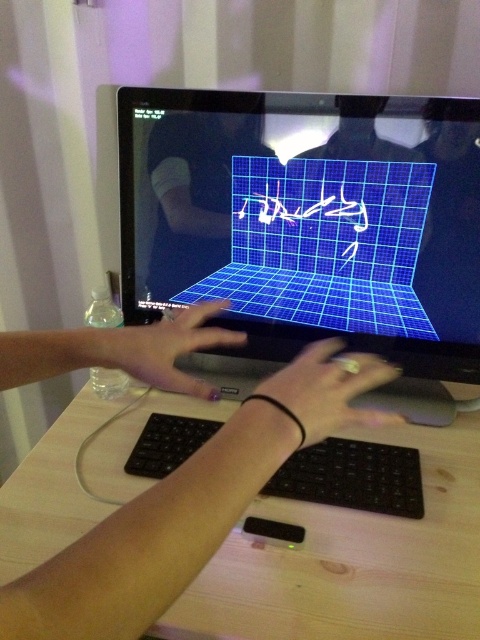
Question: Estimate the real-world distances between objects in this image. Which object is farther from the matte black hand at center?

Choices:
 (A) matte black hands at center
 (B) black glossy monitor at center
 (C) light wood table at center

Answer: (C)

Question: Is black matte hand at center positioned at the back of matte black hand at center?

Choices:
 (A) yes
 (B) no

Answer: (B)

Question: Considering the real-world distances, which object is closest to the black matte keyboard at center?

Choices:
 (A) matte black hand at center
 (B) matte black hands at center
 (C) blue grid paper at center
 (D) black glossy monitor at center

Answer: (A)

Question: Is light wood table at center smaller than black matte keyboard at center?

Choices:
 (A) no
 (B) yes

Answer: (A)

Question: Among these points, which one is nearest to the camera?

Choices:
 (A) (463, 204)
 (B) (163, 200)

Answer: (A)

Question: In this image, where is blue grid paper at center located relative to black matte hand at center?

Choices:
 (A) right
 (B) left

Answer: (B)